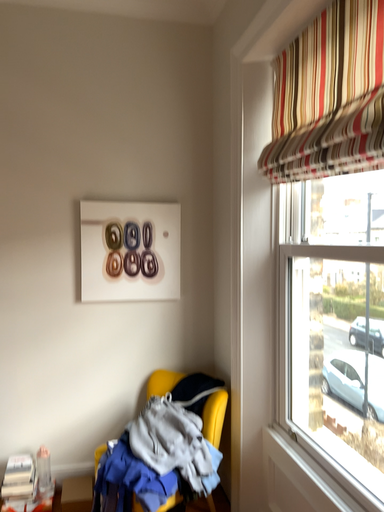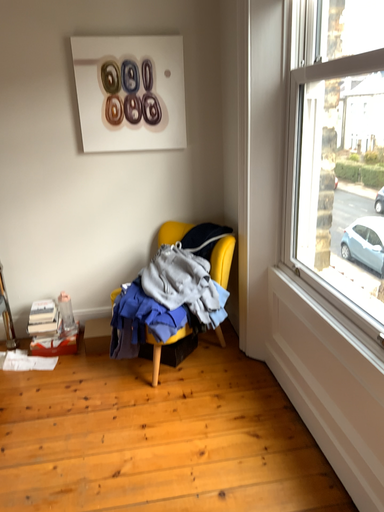
Question: Which way did the camera rotate in the video?

Choices:
 (A) rotated upward
 (B) rotated downward

Answer: (B)